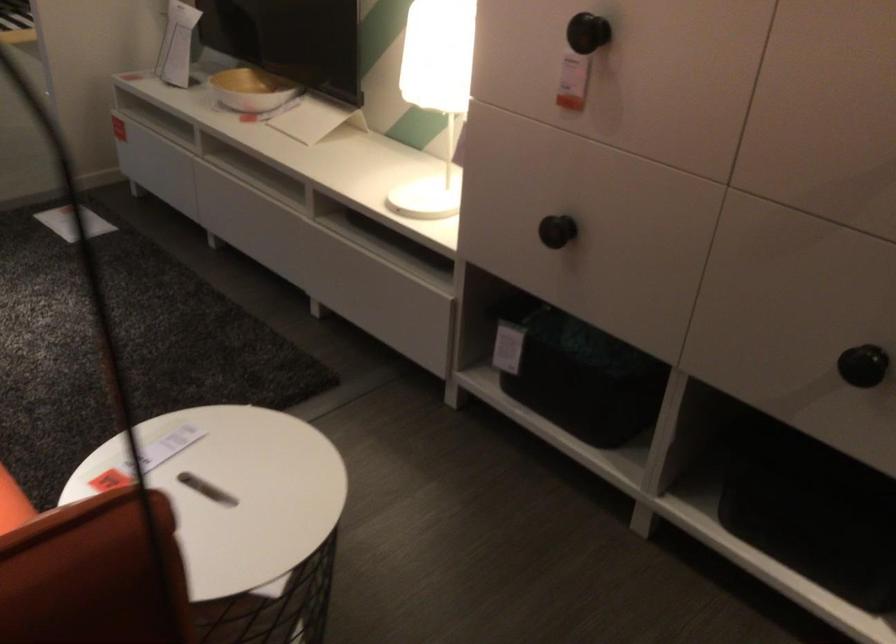
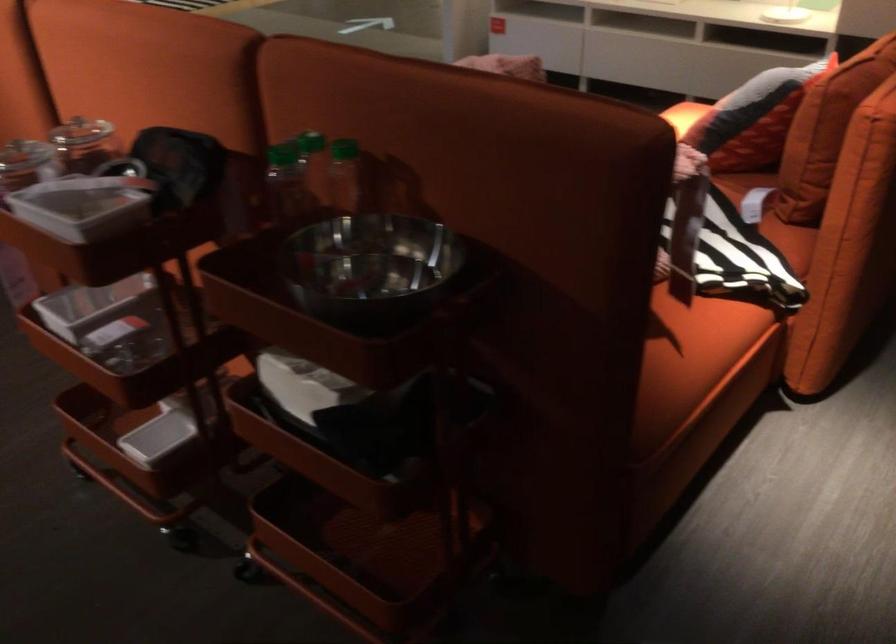
In a continuous first-person perspective shot, in which direction is the camera moving?

The cameraman walked toward left, backward.